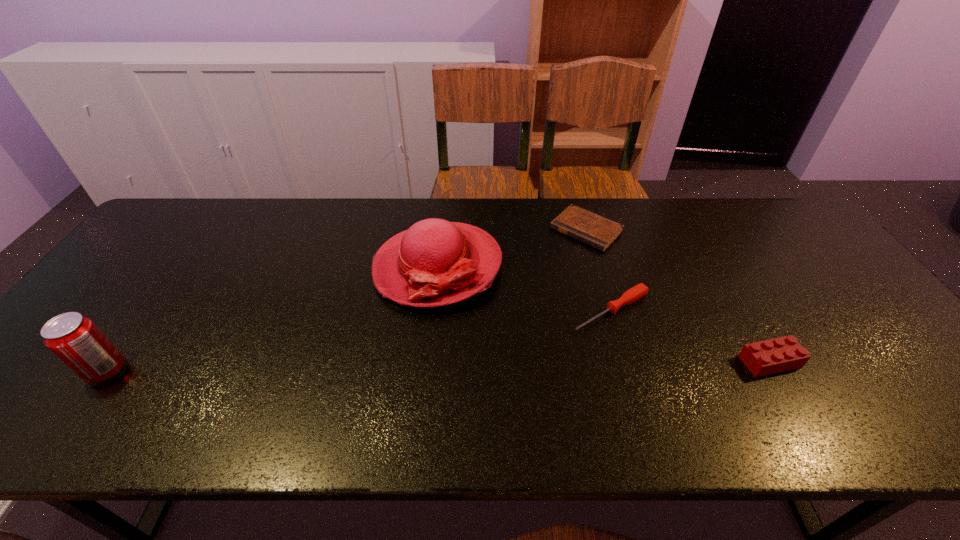
What are the coordinates of `vacant space on the desktop that is between the leftmost object and the Lego and is positioned on the spine side of the shortest object` in the screenshot? It's located at (448, 366).

Identify the location of vacant space on the desktop that is between the leftmost object and the third shortest object and is positioned at the front of the hat with a bow. This screenshot has width=960, height=540. (353, 367).

Find the location of a particular element. vacant space on the desktop that is between the soda and the third tallest object and is positioned at the tip of the screwdriver is located at coordinates (521, 365).